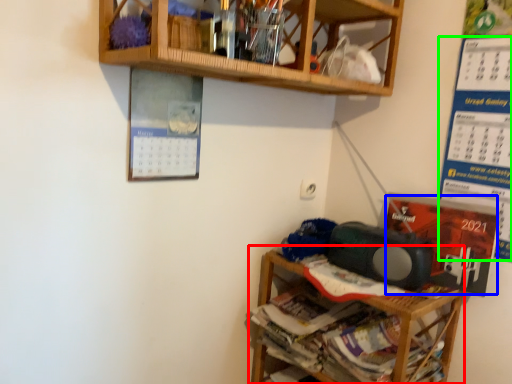
Question: Considering the real-world distances, which object is farthest from shelf (highlighted by a red box)? writing (highlighted by a blue box) or writing (highlighted by a green box)?

Choices:
 (A) writing
 (B) writing

Answer: (B)